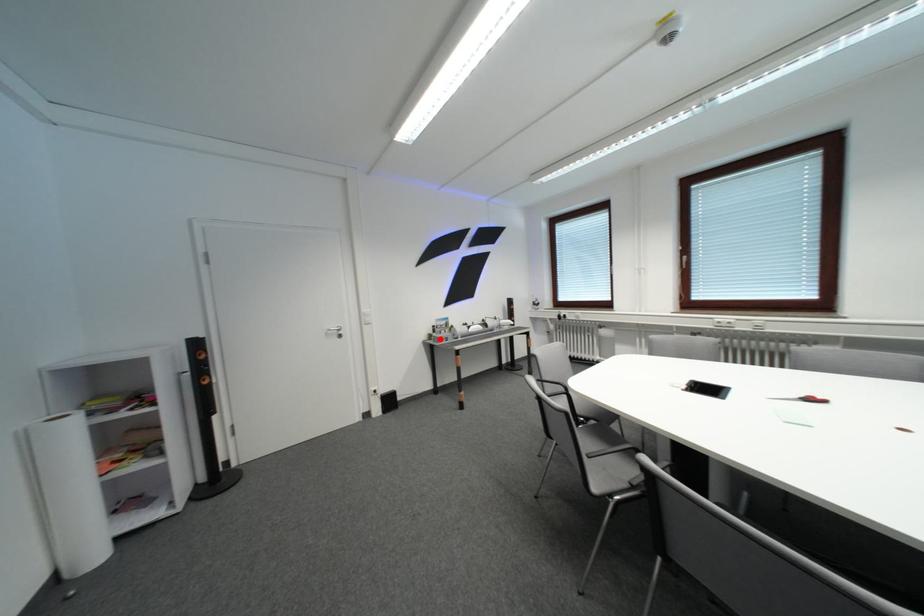
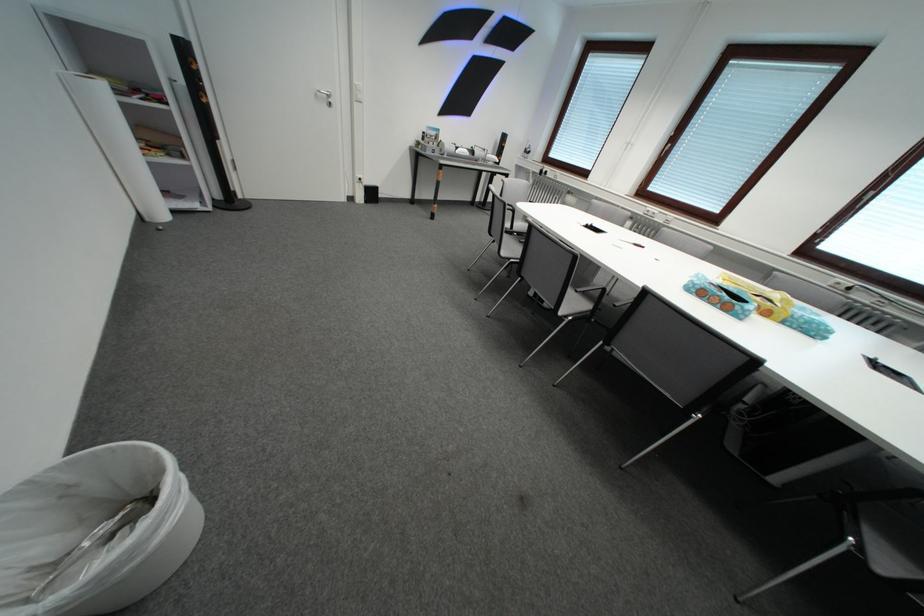
Question: I am providing you with two images of the same scene from different viewpoints. A red point is marked on the first image. Can you still see the location of the red point in image 2?

Choices:
 (A) Yes
 (B) No

Answer: (A)